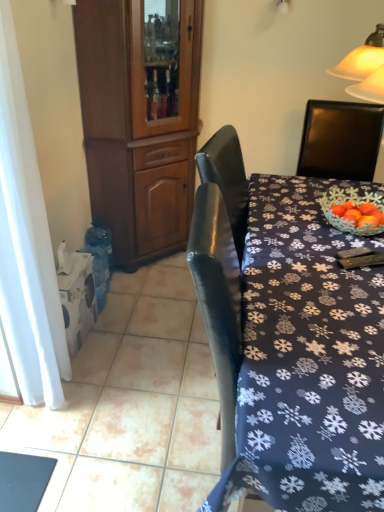
Question: From a real-world perspective, is dark blue fabric tablecloth at center on white sheer curtain at left?

Choices:
 (A) yes
 (B) no

Answer: (B)

Question: Considering the relative sizes of dark blue fabric tablecloth at center and white sheer curtain at left in the image provided, is dark blue fabric tablecloth at center wider than white sheer curtain at left?

Choices:
 (A) yes
 (B) no

Answer: (A)

Question: Considering the relative sizes of dark blue fabric tablecloth at center and white sheer curtain at left in the image provided, is dark blue fabric tablecloth at center taller than white sheer curtain at left?

Choices:
 (A) yes
 (B) no

Answer: (B)

Question: Does dark blue fabric tablecloth at center touch white sheer curtain at left?

Choices:
 (A) no
 (B) yes

Answer: (A)

Question: Considering the relative positions of dark blue fabric tablecloth at center and white sheer curtain at left in the image provided, is dark blue fabric tablecloth at center to the right of white sheer curtain at left from the viewer's perspective?

Choices:
 (A) no
 (B) yes

Answer: (B)

Question: From the image's perspective, is dark blue fabric tablecloth at center over white sheer curtain at left?

Choices:
 (A) yes
 (B) no

Answer: (B)

Question: From the image's perspective, is white sheer curtain at left under dark blue fabric tablecloth at center?

Choices:
 (A) yes
 (B) no

Answer: (B)

Question: Is white sheer curtain at left oriented towards dark blue fabric tablecloth at center?

Choices:
 (A) yes
 (B) no

Answer: (A)

Question: Is white sheer curtain at left oriented away from dark blue fabric tablecloth at center?

Choices:
 (A) no
 (B) yes

Answer: (A)

Question: Does white sheer curtain at left touch dark blue fabric tablecloth at center?

Choices:
 (A) no
 (B) yes

Answer: (A)

Question: Considering the relative positions of white sheer curtain at left and dark blue fabric tablecloth at center in the image provided, is white sheer curtain at left to the left of dark blue fabric tablecloth at center from the viewer's perspective?

Choices:
 (A) yes
 (B) no

Answer: (A)

Question: From a real-world perspective, is white sheer curtain at left located higher than dark blue fabric tablecloth at center?

Choices:
 (A) yes
 (B) no

Answer: (A)

Question: Does dark blue fabric tablecloth at center contain brown wood cabinet at left?

Choices:
 (A) no
 (B) yes

Answer: (A)